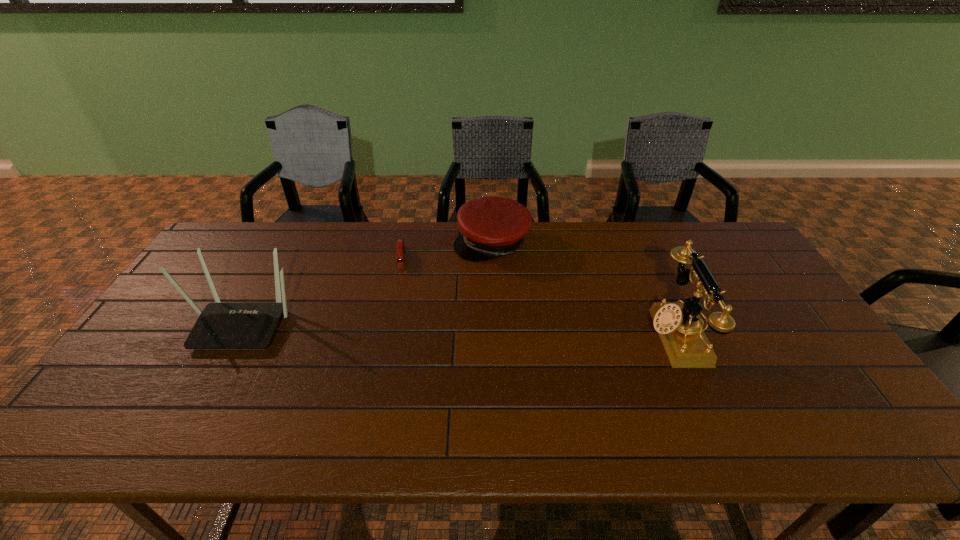
At what (x,y) coordinates should I click in order to perform the action: click on the leftmost object. Please return your answer as a coordinate pair (x, y). The image size is (960, 540). Looking at the image, I should click on (220, 325).

Find the location of a particular element. The width and height of the screenshot is (960, 540). the second tallest object is located at coordinates (220, 325).

Identify the location of telephone. (677, 323).

Locate an element on the screen. This screenshot has height=540, width=960. the tallest object is located at coordinates (677, 323).

At what (x,y) coordinates should I click in order to perform the action: click on the third object from left to right. Please return your answer as a coordinate pair (x, y). Looking at the image, I should click on (491, 227).

Identify the location of cap. (491, 227).

Find the location of `stapler`. stapler is located at coordinates (400, 242).

You are a GUI agent. You are given a task and a screenshot of the screen. Output one action in this format:
    pyautogui.click(x=<x>, y=<y>)
    Task: Click on the shortest object
    This screenshot has width=960, height=540.
    Given the screenshot: What is the action you would take?
    pyautogui.click(x=400, y=242)

In order to click on free space located on the front-facing side of the leftmost object in this screenshot , I will do `click(198, 407)`.

This screenshot has width=960, height=540. Find the location of `vacant region located 0.210m on the dial of the tallest object`. vacant region located 0.210m on the dial of the tallest object is located at coordinates (573, 335).